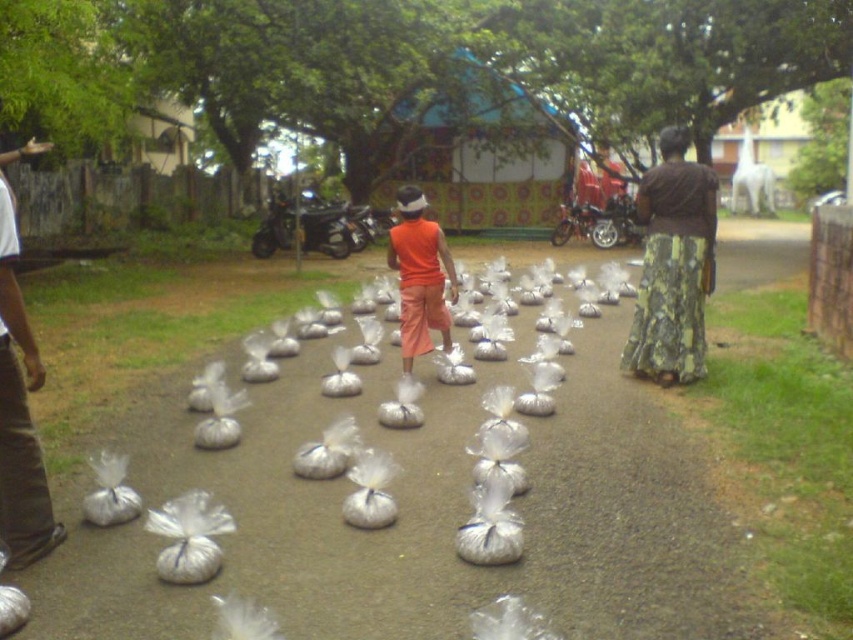
Does transparent plastic bags at center have a lesser height compared to orange cotton shorts at center?

Yes, transparent plastic bags at center is shorter than orange cotton shorts at center.

You are a GUI agent. You are given a task and a screenshot of the screen. Output one action in this format:
    pyautogui.click(x=<x>, y=<y>)
    Task: Click on the transparent plastic bags at center
    The width and height of the screenshot is (853, 640).
    Given the screenshot: What is the action you would take?
    pyautogui.click(x=416, y=515)

Is green floral skirt at right thinner than orange cotton shorts at center?

In fact, green floral skirt at right might be wider than orange cotton shorts at center.

Who is more distant from viewer, (700, 307) or (409, 211)?

The point (700, 307) is more distant.

Does point (706, 209) come in front of point (413, 266)?

Yes, it is in front of point (413, 266).

At what (x,y) coordinates should I click in order to perform the action: click on green floral skirt at right. Please return your answer as a coordinate pair (x, y). This screenshot has height=640, width=853. Looking at the image, I should click on (672, 266).

What do you see at coordinates (19, 417) in the screenshot? I see `brown corduroy pants at left` at bounding box center [19, 417].

Is point (25, 428) positioned after point (444, 241)?

No, (25, 428) is closer to viewer.

Where is `brown corduroy pants at left`? This screenshot has height=640, width=853. brown corduroy pants at left is located at coordinates click(19, 417).